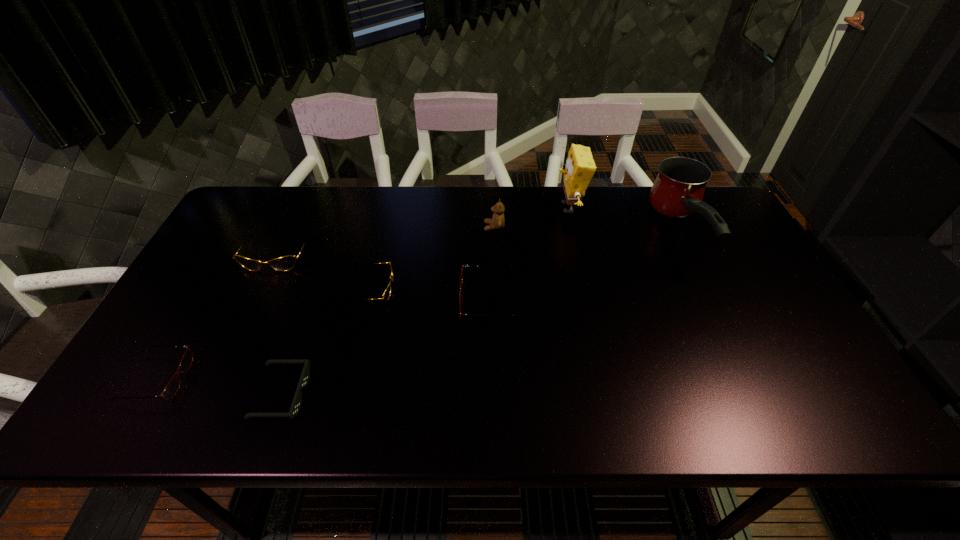
Image resolution: width=960 pixels, height=540 pixels. What are the coordinates of `free space between the nearest spectacles and the right gold spectacles` in the screenshot? It's located at (265, 333).

I want to click on free space between the left gold spectacles and the sunglasses, so click(x=279, y=324).

Locate which object ranks fifth in proximity to the farther red spectacles. Please provide its 2D coordinates. Your answer should be formatted as a tuple, i.e. [(x, y)], where the tuple contains the x and y coordinates of a point satisfying the conditions above.

[(678, 190)]

Select which object is the sixth closest to the teddy bear. Please provide its 2D coordinates. Your answer should be formatted as a tuple, i.e. [(x, y)], where the tuple contains the x and y coordinates of a point satisfying the conditions above.

[(305, 375)]

The height and width of the screenshot is (540, 960). What are the coordinates of `spectacles identified as the closest to the right red spectacles` in the screenshot? It's located at (387, 292).

Locate an element on the screen. spectacles object that ranks as the second closest to the sunglasses is located at coordinates (387, 292).

Find the location of `vacant area that satisfies the following two spatial constraints: 1. on the handle side of the saucepan; 2. on the lenses of the right red spectacles`. vacant area that satisfies the following two spatial constraints: 1. on the handle side of the saucepan; 2. on the lenses of the right red spectacles is located at coordinates (715, 301).

Identify the location of free spot that satisfies the following two spatial constraints: 1. on the handle side of the rightmost object; 2. on the front-facing side of the sunglasses. (761, 394).

Where is `free space that satisfies the following two spatial constraints: 1. on the front-facing side of the bigger gold spectacles; 2. on the lenses of the left red spectacles`? free space that satisfies the following two spatial constraints: 1. on the front-facing side of the bigger gold spectacles; 2. on the lenses of the left red spectacles is located at coordinates (219, 379).